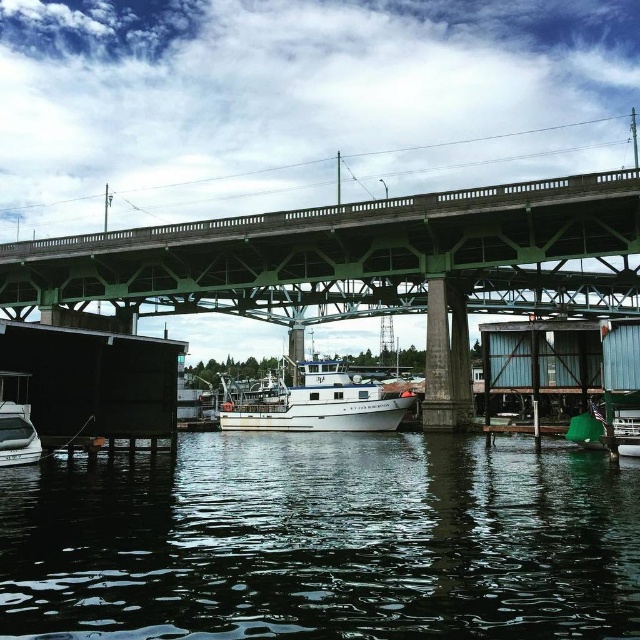
Question: Among these points, which one is nearest to the camera?

Choices:
 (A) (365, 435)
 (B) (401, 243)
 (C) (230, 412)

Answer: (B)

Question: Does green concrete bridge at center appear under white matte boat at center?

Choices:
 (A) no
 (B) yes

Answer: (A)

Question: Based on their relative distances, which object is nearer to the green concrete bridge at center?

Choices:
 (A) transparent water at lower center
 (B) white matte boat at center

Answer: (B)

Question: Which point is closer to the camera?

Choices:
 (A) (582, 513)
 (B) (64, 300)

Answer: (A)

Question: Can you confirm if transparent water at lower center is positioned to the left of white matte boat at center?

Choices:
 (A) yes
 (B) no

Answer: (B)

Question: Can you confirm if transparent water at lower center is positioned above white matte boat at center?

Choices:
 (A) yes
 (B) no

Answer: (B)